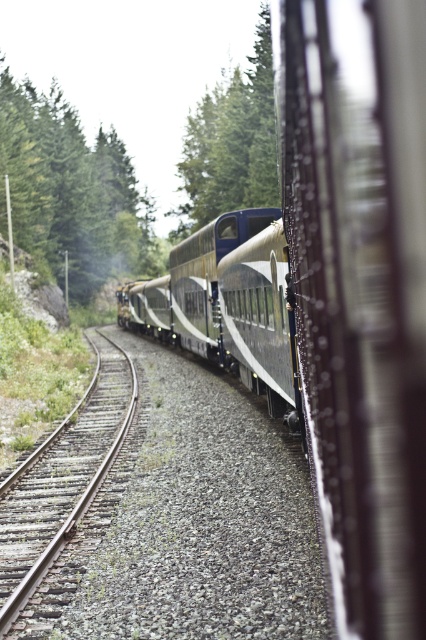
Question: Which of these objects is positioned closest to the green textured tree at upper center?

Choices:
 (A) green textured tree at upper left
 (B) polished silver train at center

Answer: (A)

Question: Can you confirm if polished silver train at center is positioned below green textured tree at upper left?

Choices:
 (A) yes
 (B) no

Answer: (A)

Question: Is green textured tree at upper center below brown gravel train track at left?

Choices:
 (A) no
 (B) yes

Answer: (A)

Question: Which of the following is the farthest from the observer?

Choices:
 (A) brown gravel train track at left
 (B) green textured tree at upper center

Answer: (B)

Question: Is polished silver train at center to the right of green textured tree at upper left from the viewer's perspective?

Choices:
 (A) no
 (B) yes

Answer: (B)

Question: Among these objects, which one is farthest from the camera?

Choices:
 (A) brown gravel train track at left
 (B) polished silver train at center

Answer: (A)